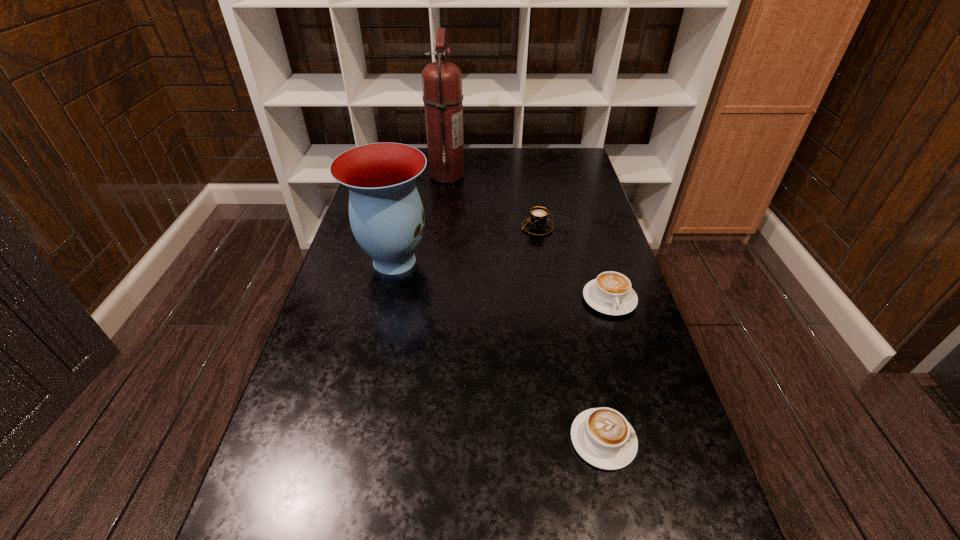
You are a GUI agent. You are given a task and a screenshot of the screen. Output one action in this format:
    pyautogui.click(x=<x>, y=<y>)
    Task: Click on the vacant area situated 0.060m with the handle on the right side of the nearest object
    The image size is (960, 540).
    Given the screenshot: What is the action you would take?
    pyautogui.click(x=666, y=440)

You are a GUI agent. You are given a task and a screenshot of the screen. Output one action in this format:
    pyautogui.click(x=<x>, y=<y>)
    Task: Click on the object that is at the far edge
    
    Given the screenshot: What is the action you would take?
    pyautogui.click(x=442, y=81)

Find the location of a particular element. The width and height of the screenshot is (960, 540). object located at the left edge is located at coordinates (386, 214).

The height and width of the screenshot is (540, 960). In the image, there is a desktop. What are the coordinates of `free space at the far edge` in the screenshot? It's located at (466, 159).

At what (x,y) coordinates should I click in order to perform the action: click on vacant area at the left edge. Please return your answer as a coordinate pair (x, y). Looking at the image, I should click on (386, 300).

In the image, there is a desktop. Identify the location of vacant area at the right edge. (581, 256).

This screenshot has height=540, width=960. In order to click on free space at the far right corner of the desktop in this screenshot , I will do `click(586, 175)`.

I want to click on free spot between the fire extinguisher and the nearest cappuccino, so click(525, 307).

The image size is (960, 540). I want to click on unoccupied area between the nearest object and the farthest cappuccino, so click(570, 334).

Locate an element on the screen. The image size is (960, 540). empty location between the vase and the second farthest cappuccino is located at coordinates (502, 280).